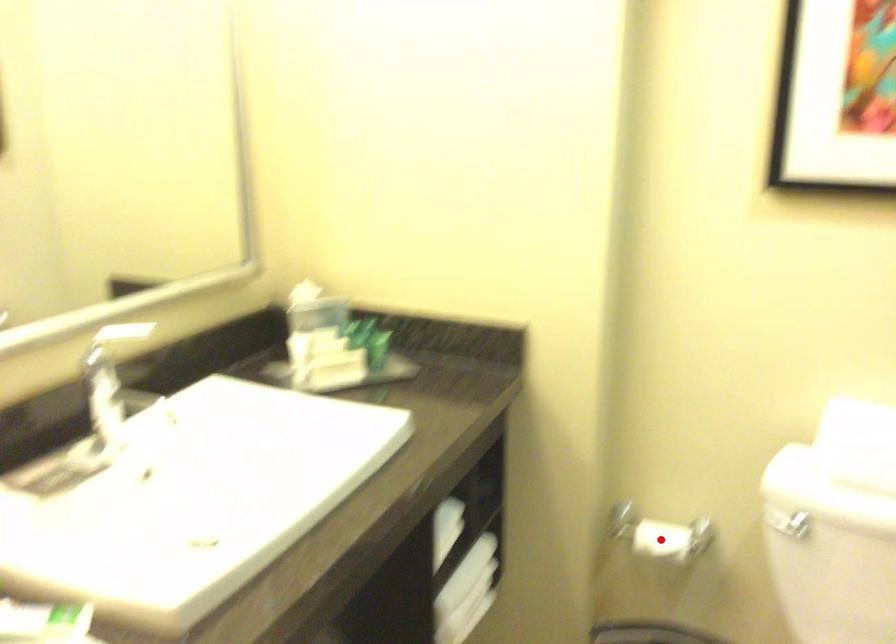
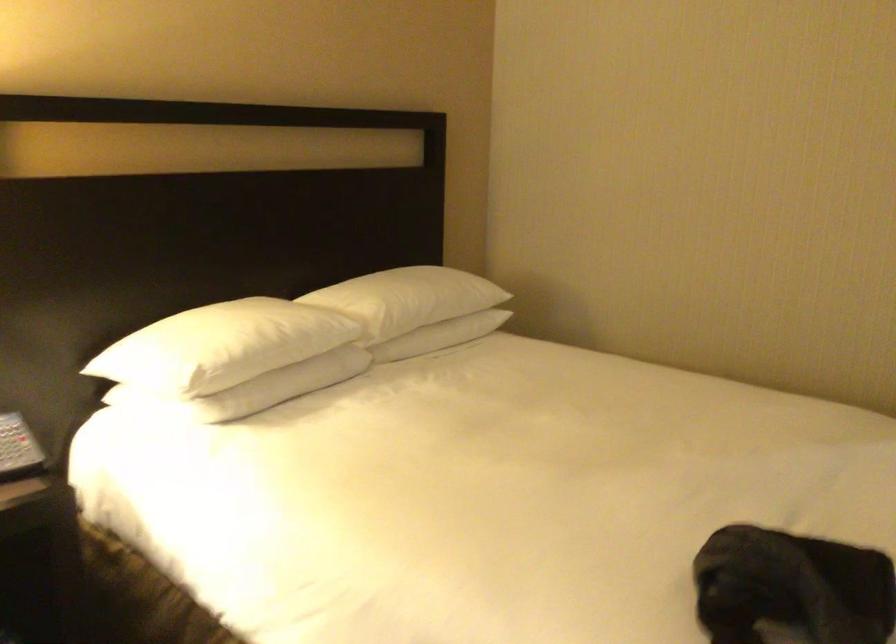
Question: I am providing you with two images of the same scene from different viewpoints. A red point is marked on the first image. Can you still see the location of the red point in image 2?

Choices:
 (A) Yes
 (B) No

Answer: (B)